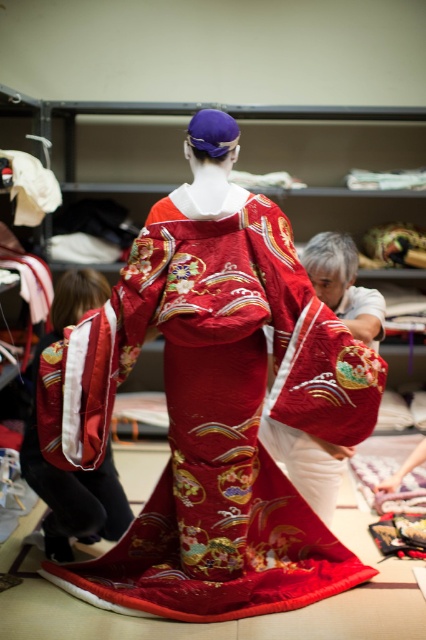
Between silky red kimono at center and velvet red kimono at lower left, which one is positioned lower?

velvet red kimono at lower left is lower down.

Where is `silky red kimono at center`? This screenshot has width=426, height=640. silky red kimono at center is located at coordinates (344, 285).

Is point (330, 486) positioned in front of point (31, 388)?

Yes.

This screenshot has height=640, width=426. What are the coordinates of `silky red kimono at center` in the screenshot? It's located at (344, 285).